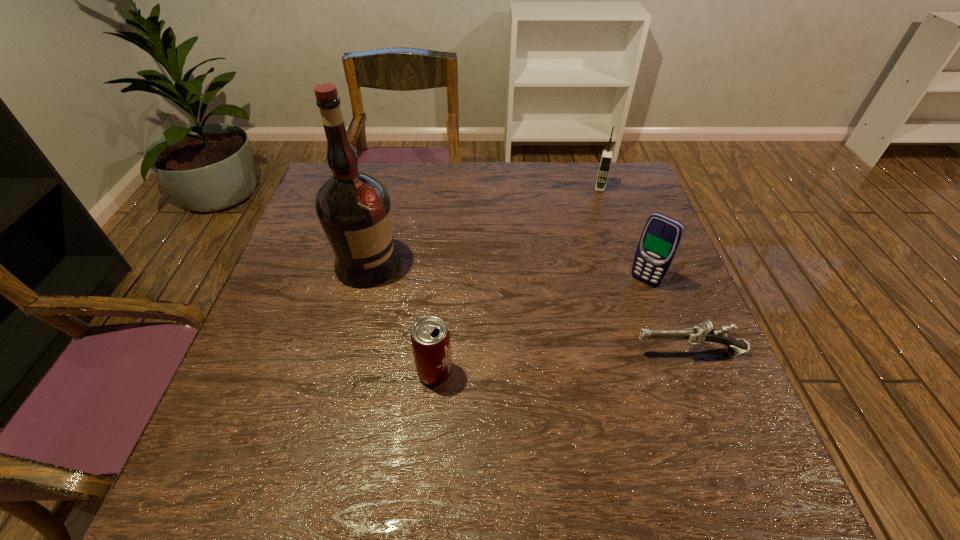
Identify the location of free point located aimed along the barrel of the gun. This screenshot has width=960, height=540. point(538,353).

I want to click on vacant region located 0.350m on the front-facing side of the nearer cellular telephone, so click(x=555, y=388).

I want to click on vacant space situated on the front-facing side of the nearer cellular telephone, so click(x=614, y=316).

The height and width of the screenshot is (540, 960). Find the location of `free spot located on the front-facing side of the nearer cellular telephone`. free spot located on the front-facing side of the nearer cellular telephone is located at coordinates (582, 355).

Find the location of a particular element. free point located on the surface of the leftmost object is located at coordinates (528, 352).

Image resolution: width=960 pixels, height=540 pixels. In order to click on free spot located 0.080m on the surface of the leftmost object in this screenshot , I will do `click(419, 292)`.

The height and width of the screenshot is (540, 960). In order to click on vacant position located on the surface of the leftmost object in this screenshot , I will do `click(533, 354)`.

The height and width of the screenshot is (540, 960). In order to click on vacant position located 0.200m on the front-facing side of the farthest object in this screenshot , I will do `click(594, 234)`.

Where is `free region located on the front-facing side of the farthest object`? The height and width of the screenshot is (540, 960). free region located on the front-facing side of the farthest object is located at coordinates pos(593,244).

Identify the location of vacant space situated 0.340m on the front-facing side of the farthest object. (589, 269).